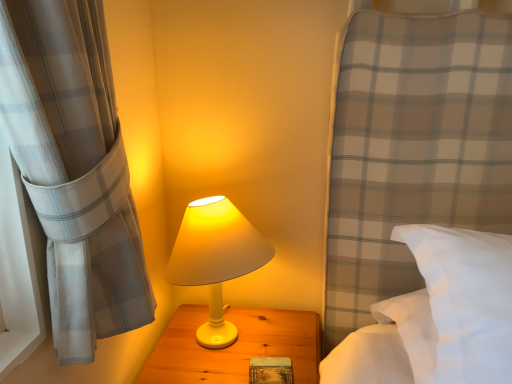
The image size is (512, 384). What do you see at coordinates (270, 370) in the screenshot?
I see `wooden textured book at center` at bounding box center [270, 370].

I want to click on white matte lamp at center, so click(215, 259).

From the image's perspective, between white matte wood nightstand at center and wooden textured book at center, who is located below?

white matte wood nightstand at center.

Between white matte wood nightstand at center and wooden textured book at center, which one has less height?

wooden textured book at center.

Considering the sizes of objects white matte wood nightstand at center and wooden textured book at center in the image provided, who is thinner, white matte wood nightstand at center or wooden textured book at center?

wooden textured book at center.

Can you see white matte wood nightstand at center touching wooden textured book at center?

No.

The image size is (512, 384). What are the coordinates of `bed positioned vertically above the white matte lamp at center (from a real-world perspective)` in the screenshot? It's located at (438, 316).

From the image's perspective, is white matte lamp at center on top of white soft pillow at right?

No, from the image's perspective, white matte lamp at center is not above white soft pillow at right.

Which object is closer to the camera taking this photo, white matte lamp at center or white soft pillow at right?

white soft pillow at right is in front.

Based on the photo, from a real-world perspective, between white matte lamp at center and white soft pillow at right, who is vertically lower?

white matte lamp at center.

In the scene shown: Considering the positions of objects wooden textured book at center and white matte lamp at center in the image provided, who is more to the left, wooden textured book at center or white matte lamp at center?

From the viewer's perspective, white matte lamp at center appears more on the left side.

Is wooden textured book at center next to white matte lamp at center?

No, wooden textured book at center is not touching white matte lamp at center.

Is wooden textured book at center turned away from white matte lamp at center?

That's not correct — wooden textured book at center is not looking away from white matte lamp at center.

What's the angular difference between wooden textured book at center and white soft pillow at right's facing directions?

The angle between the facing direction of wooden textured book at center and the facing direction of white soft pillow at right is 0.147 degrees.

From the image's perspective, relative to white soft pillow at right, is wooden textured book at center above or below?

Clearly, from the image's perspective, wooden textured book at center is below white soft pillow at right.

Considering the sizes of wooden textured book at center and white soft pillow at right in the image, is wooden textured book at center taller or shorter than white soft pillow at right?

Clearly, wooden textured book at center is shorter compared to white soft pillow at right.

From a real-world perspective, relative to white soft pillow at right, is wooden textured book at center vertically above or below?

Clearly, from a real-world perspective, wooden textured book at center is below white soft pillow at right.

Is white matte wood nightstand at center facing away from white soft pillow at right?

That's not correct — white matte wood nightstand at center is not looking away from white soft pillow at right.

Based on the photo, which of these two, white matte wood nightstand at center or white soft pillow at right, is wider?

With larger width is white soft pillow at right.

Which is closer, (166, 369) or (402, 296)?

Point (166, 369) is closer to the camera than point (402, 296).

Consider the image. From a real-world perspective, who is located lower, white soft pillow at right or white matte lamp at center?

white matte lamp at center is physically lower.

Can you confirm if white soft pillow at right is positioned to the left of white matte lamp at center?

No.

Is white soft pillow at right placed right next to white matte lamp at center?

They are not placed beside each other.

Between point (472, 292) and point (222, 259), which one is positioned behind?

The point (222, 259) is behind.

From the image's perspective, which one is positioned higher, white soft pillow at right or wooden textured book at center?

white soft pillow at right appears higher in the image.

Is white soft pillow at right bigger than wooden textured book at center?

Correct, white soft pillow at right is larger in size than wooden textured book at center.

Is wooden textured book at center surrounded by white soft pillow at right?

Actually, wooden textured book at center is outside white soft pillow at right.

Locate an element on the screen. The image size is (512, 384). book behind the white matte wood nightstand at center is located at coordinates (270, 370).

Locate an element on the screen. The image size is (512, 384). lamp located on the left of white soft pillow at right is located at coordinates (215, 259).

Which object lies further to the anchor point white soft pillow at right, wooden textured book at center or white matte wood nightstand at center?

Among the two, wooden textured book at center is located further to white soft pillow at right.

When comparing their distances from white matte wood nightstand at center, does white soft pillow at right or wooden textured book at center seem further?

white soft pillow at right is further to white matte wood nightstand at center.

Estimate the real-world distances between objects in this image. Which object is closer to wooden textured book at center, white soft pillow at right or white matte lamp at center?

Based on the image, white matte lamp at center appears to be nearer to wooden textured book at center.

Looking at this image, estimate the real-world distances between objects in this image. Which object is further from white matte lamp at center, white matte wood nightstand at center or wooden textured book at center?

wooden textured book at center is further to white matte lamp at center.

Which object lies further to the anchor point wooden textured book at center, white matte lamp at center or white soft pillow at right?

Based on the image, white soft pillow at right appears to be further to wooden textured book at center.

When comparing their distances from white soft pillow at right, does white matte wood nightstand at center or white matte lamp at center seem closer?

Among the two, white matte wood nightstand at center is located nearer to white soft pillow at right.

Estimate the real-world distances between objects in this image. Which object is closer to white matte wood nightstand at center, white matte lamp at center or wooden textured book at center?

wooden textured book at center is closer to white matte wood nightstand at center.

In the scene shown: Considering their positions, is white matte wood nightstand at center positioned closer to white matte lamp at center than white soft pillow at right?

Among the two, white matte wood nightstand at center is located nearer to white matte lamp at center.

Identify the location of book between white matte lamp at center and white soft pillow at right from left to right. Image resolution: width=512 pixels, height=384 pixels. (270, 370).

You are a GUI agent. You are given a task and a screenshot of the screen. Output one action in this format:
    pyautogui.click(x=<x>, y=<y>)
    Task: Click on the nightstand situated between white matte lamp at center and white soft pillow at right from left to right
    
    Given the screenshot: What is the action you would take?
    pyautogui.click(x=234, y=346)

You are a GUI agent. You are given a task and a screenshot of the screen. Output one action in this format:
    pyautogui.click(x=<x>, y=<y>)
    Task: Click on the nightstand located between white soft pillow at right and wooden textured book at center in the depth direction
    
    Given the screenshot: What is the action you would take?
    pyautogui.click(x=234, y=346)

Where is `book between white matte lamp at center and white matte wood nightstand at center from top to bottom`? book between white matte lamp at center and white matte wood nightstand at center from top to bottom is located at coordinates (270, 370).